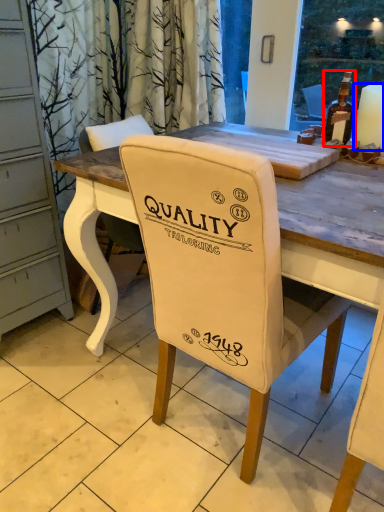
Question: Among these objects, which one is farthest to the camera, bottle (highlighted by a red box) or candle (highlighted by a blue box)?

Choices:
 (A) bottle
 (B) candle

Answer: (A)